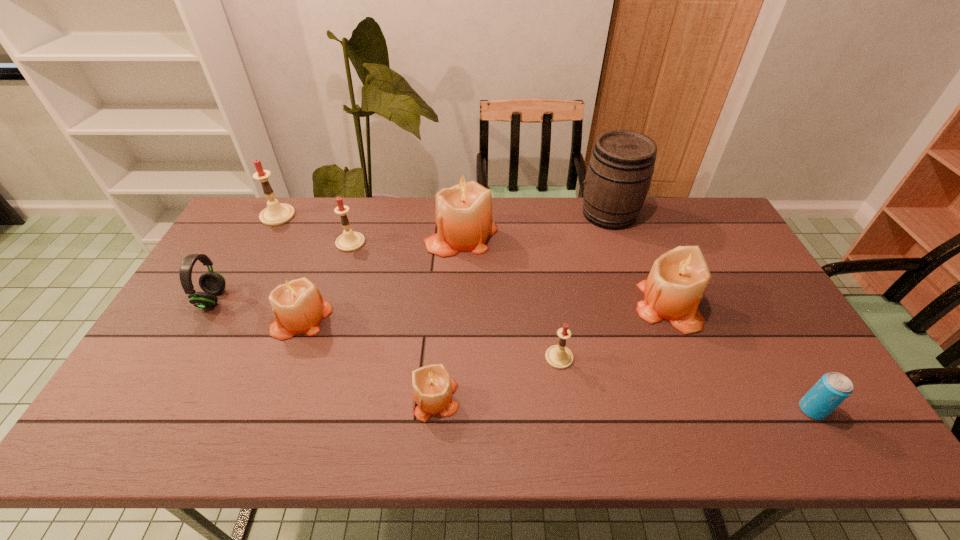
Locate an element on the screen. the smallest red candle is located at coordinates (558, 356).

Where is `the fourth object from right to left`? Image resolution: width=960 pixels, height=540 pixels. the fourth object from right to left is located at coordinates (558, 356).

At what (x,y) coordinates should I click in order to perform the action: click on the nearest beige candle. Please return your answer as a coordinate pair (x, y). This screenshot has height=540, width=960. Looking at the image, I should click on (432, 385).

Locate an element on the screen. the nearest candle is located at coordinates (432, 385).

Locate an element on the screen. soda can is located at coordinates (833, 388).

The image size is (960, 540). I want to click on vacant area located on the left of the wine bucket, so click(x=494, y=214).

Where is `vacant space located on the back of the farthest beige candle`? This screenshot has height=540, width=960. vacant space located on the back of the farthest beige candle is located at coordinates (463, 201).

Locate an element on the screen. The height and width of the screenshot is (540, 960). vacant space located on the front of the biggest red candle is located at coordinates click(236, 293).

Find the location of a particular element. The height and width of the screenshot is (540, 960). free space located on the right of the rightmost candle is located at coordinates (736, 306).

I want to click on free space located 0.050m on the right of the second farthest red candle, so click(380, 242).